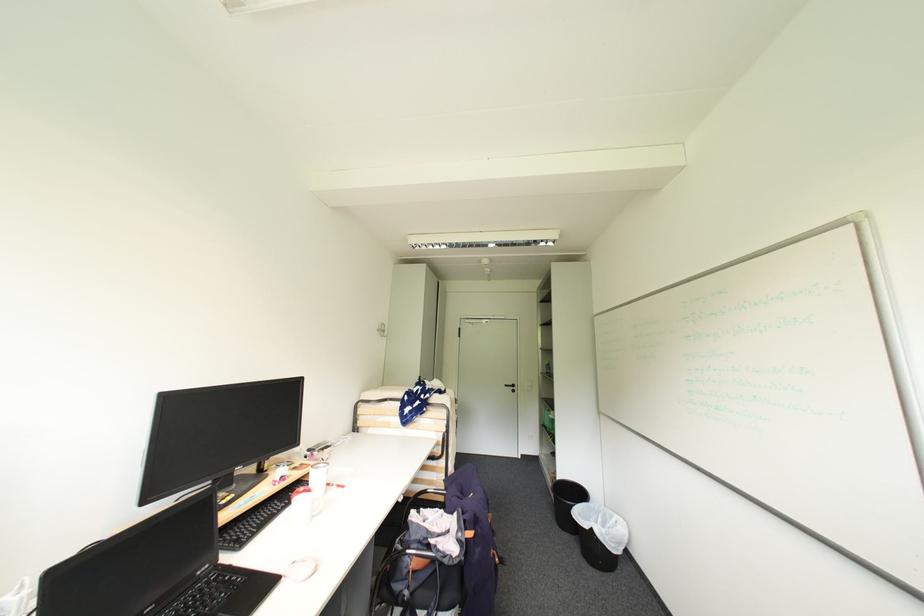
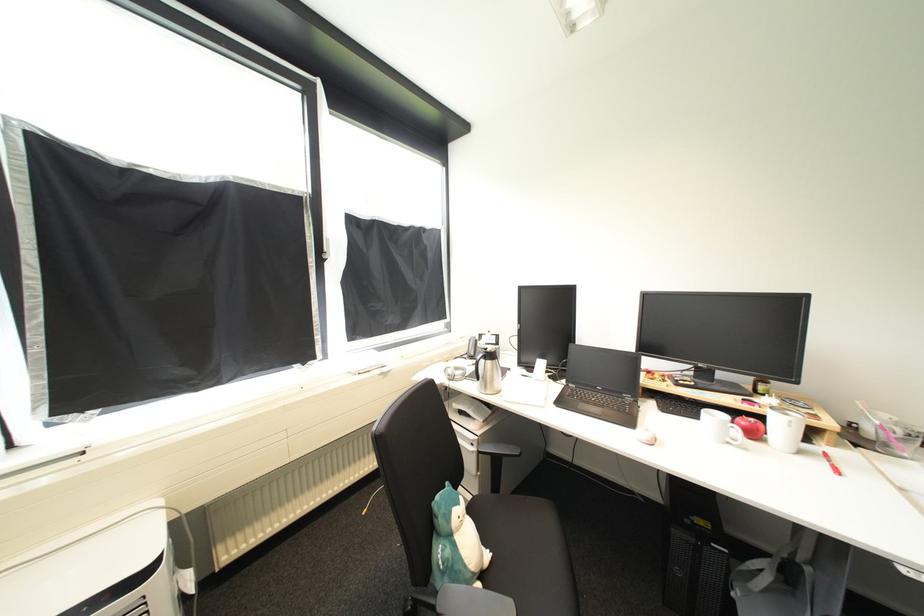
Question: I am providing you with two images of the same scene from different viewpoints. After the viewpoint changes to image2, which objects are now occluded?

Choices:
 (A) white travel cup
 (B) grey backpack
 (C) telephone handset
 (D) none of these

Answer: (D)